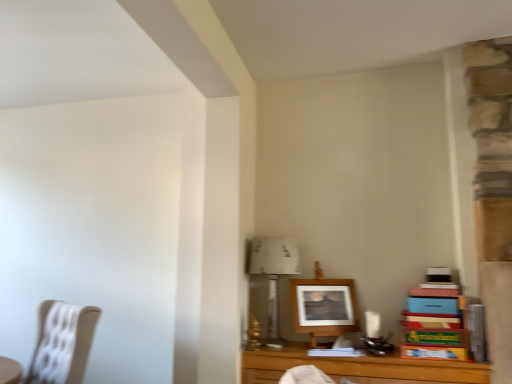
Question: Is wooden table at lower right taller than wooden frame at center?

Choices:
 (A) no
 (B) yes

Answer: (A)

Question: From the image's perspective, is wooden table at lower right below wooden frame at center?

Choices:
 (A) yes
 (B) no

Answer: (A)

Question: Is wooden table at lower right turned away from wooden frame at center?

Choices:
 (A) yes
 (B) no

Answer: (A)

Question: From a real-world perspective, is wooden table at lower right over wooden frame at center?

Choices:
 (A) no
 (B) yes

Answer: (A)

Question: Is wooden table at lower right not near wooden frame at center?

Choices:
 (A) yes
 (B) no

Answer: (B)

Question: Is wooden table at lower right in contact with wooden frame at center?

Choices:
 (A) no
 (B) yes

Answer: (A)

Question: From a real-world perspective, is wooden table at lower right beneath beige fabric chair at left?

Choices:
 (A) yes
 (B) no

Answer: (B)

Question: Is wooden table at lower right not close to beige fabric chair at left?

Choices:
 (A) no
 (B) yes

Answer: (B)

Question: Is wooden table at lower right positioned behind beige fabric chair at left?

Choices:
 (A) yes
 (B) no

Answer: (B)

Question: Is wooden table at lower right at the right side of beige fabric chair at left?

Choices:
 (A) no
 (B) yes

Answer: (B)

Question: From the image's perspective, is wooden table at lower right on top of beige fabric chair at left?

Choices:
 (A) no
 (B) yes

Answer: (B)

Question: Is wooden table at lower right at the left side of beige fabric chair at left?

Choices:
 (A) yes
 (B) no

Answer: (B)

Question: From the image's perspective, is white paper at upper center over wooden table at lower right?

Choices:
 (A) no
 (B) yes

Answer: (B)